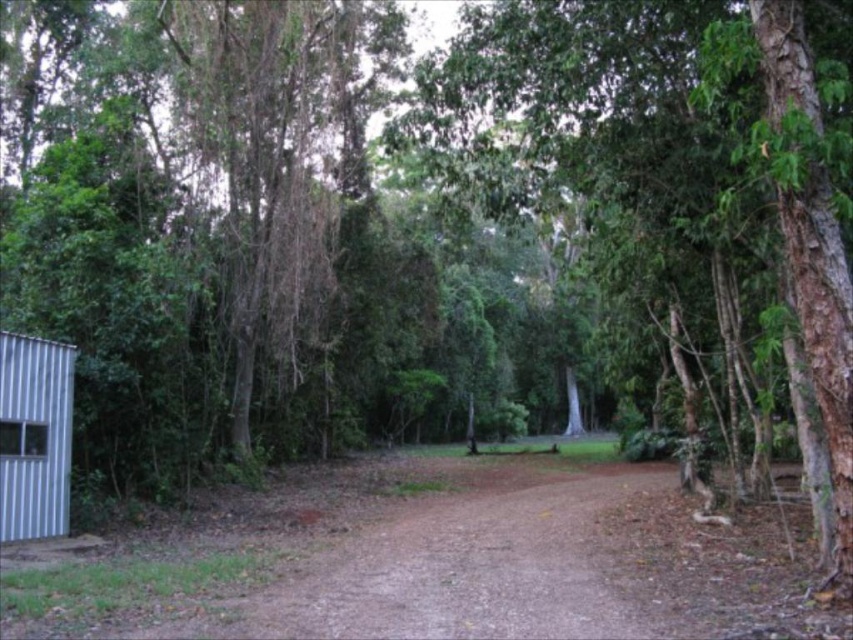
Where is the green leafy tree at center located in the image?

The green leafy tree at center is located at point (660, 170) in the image.

You are a hiker who wants to set up a tent between the green leafy tree at center and the silver corrugated hut at left. The tent requires a minimum of 10 meters of space to be set up safely. Can you set up the tent in this location?

The distance between the green leafy tree at center and the silver corrugated hut at left is 8.64 meters, which is less than the required 10 meters. Therefore, you cannot safely set up the tent in this location.

You are planning to set up a picnic area in the forest. You want to choose a spot that is under the shade of the green leafy tree at center but also close to the silver corrugated hut at left for easy access to supplies. Is the distance between the tree and the hut sufficient to accommodate a picnic blanket that is 2 meters in length?

The green leafy tree at center might be wider than silver corrugated hut at left, but the description does not provide specific distance information between them. Therefore, it is uncertain if the 2 meter picnic blanket would fit between them.